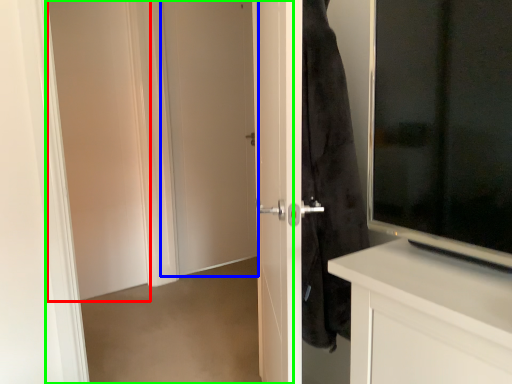
Question: Based on their relative distances, which object is farther from screen door (highlighted by a red box)? Choose from door (highlighted by a blue box) and screen door (highlighted by a green box).

Choices:
 (A) door
 (B) screen door

Answer: (A)